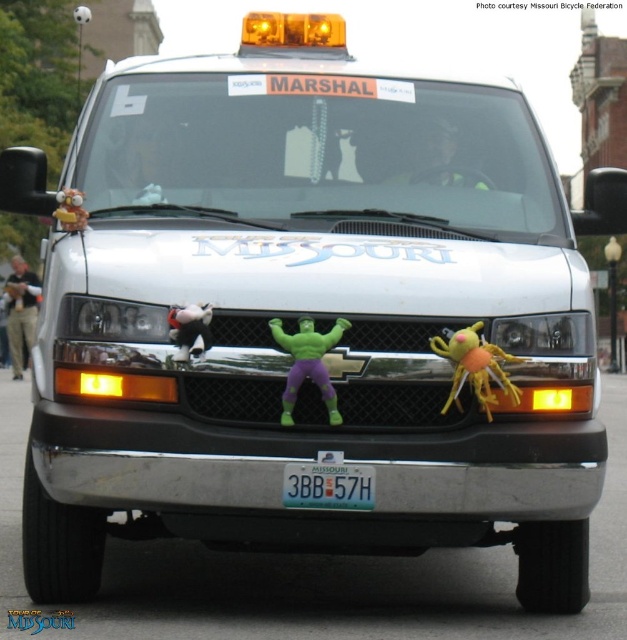
Does green rubber toy at center appear on the left side of plush yellow monkey at left?

In fact, green rubber toy at center is to the right of plush yellow monkey at left.

Does green rubber toy at center have a lesser height compared to plush yellow monkey at left?

No.

Who is more forward, (314, 339) or (61, 204)?

Point (314, 339)

This screenshot has height=640, width=627. Identify the location of green rubber toy at center. (307, 364).

Is blue metallic license plate at center to the right of white plush duck at center from the viewer's perspective?

Correct, you'll find blue metallic license plate at center to the right of white plush duck at center.

From the picture: Between blue metallic license plate at center and white plush duck at center, which one is positioned lower?

blue metallic license plate at center is lower down.

Locate an element on the screen. The height and width of the screenshot is (640, 627). blue metallic license plate at center is located at coordinates (329, 484).

Identify the location of yellow fuzzy spider at center. The height and width of the screenshot is (640, 627). (475, 365).

Between yellow fuzzy spider at center and white plush duck at center, which one is positioned lower?

yellow fuzzy spider at center is below.

Is point (487, 397) closer to viewer compared to point (174, 332)?

Yes, point (487, 397) is closer to viewer.

Find the location of a particular element. yellow fuzzy spider at center is located at coordinates (475, 365).